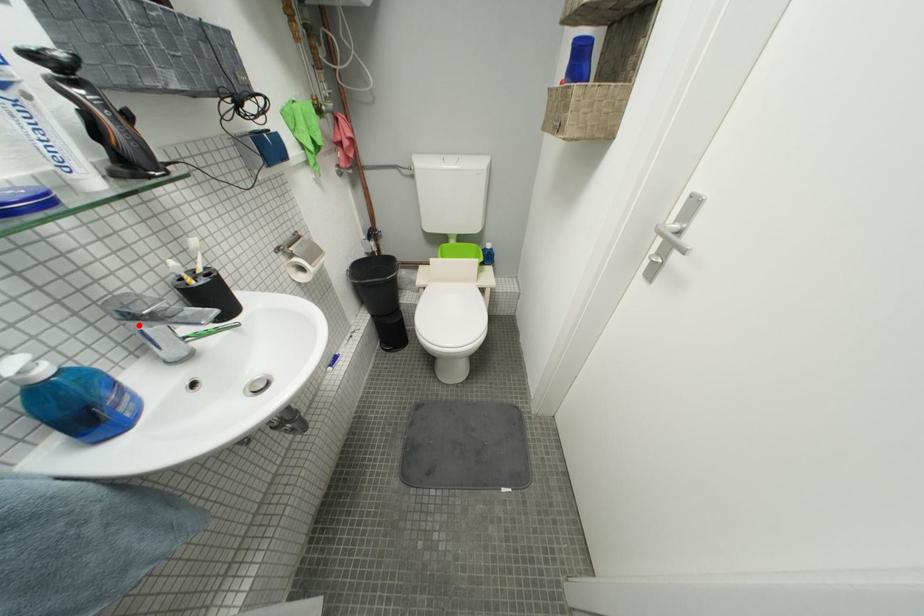
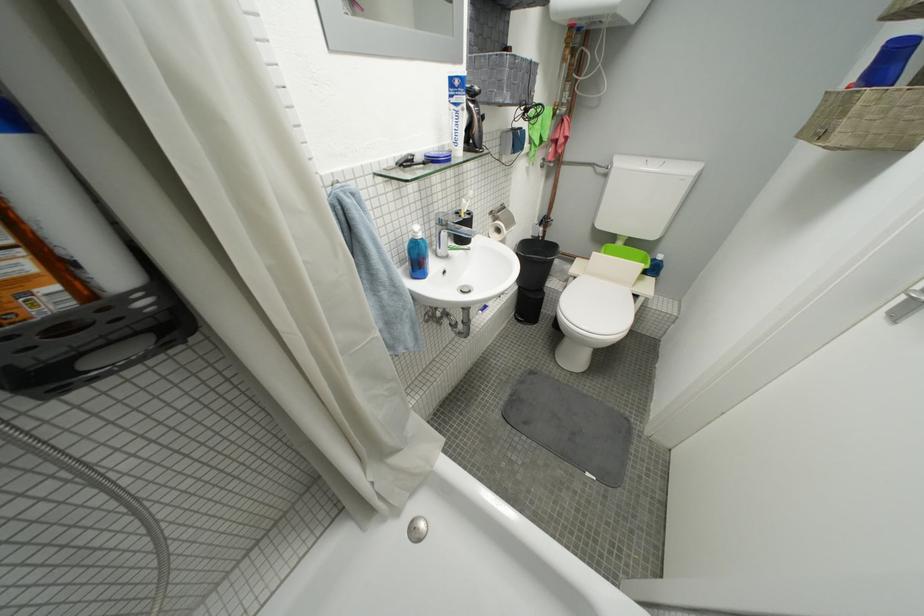
Where in the second image is the point corresponding to the highlighted location from the first image?

(447, 230)